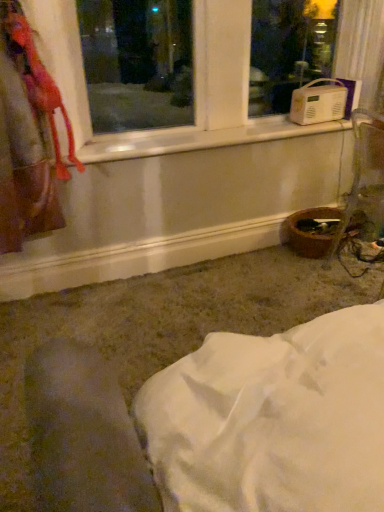
What is the approximate width of velvet-like pink scarf at upper left?

velvet-like pink scarf at upper left is 8.65 inches wide.

Where is `velvet-like pink scarf at upper left`? velvet-like pink scarf at upper left is located at coordinates coord(27,136).

Image resolution: width=384 pixels, height=512 pixels. Describe the element at coordinates (27, 136) in the screenshot. I see `velvet-like pink scarf at upper left` at that location.

This screenshot has height=512, width=384. Describe the element at coordinates (197, 61) in the screenshot. I see `white plastic radio at upper right` at that location.

The image size is (384, 512). In order to click on white plastic radio at upper right in this screenshot , I will do `click(197, 61)`.

I want to click on velvet-like pink scarf at upper left, so click(x=27, y=136).

Between velvet-like pink scarf at upper left and white plastic radio at upper right, which one appears on the left side from the viewer's perspective?

velvet-like pink scarf at upper left is more to the left.

Is velvet-like pink scarf at upper left closer to the viewer compared to white plastic radio at upper right?

Yes, the depth of velvet-like pink scarf at upper left is less than that of white plastic radio at upper right.

Does point (1, 5) come in front of point (113, 12)?

That is True.

From the picture: From the image's perspective, who appears lower, velvet-like pink scarf at upper left or white plastic radio at upper right?

velvet-like pink scarf at upper left appears lower in the image.

From a real-world perspective, is velvet-like pink scarf at upper left over white plastic radio at upper right?

No, from a real-world perspective, velvet-like pink scarf at upper left is not on top of white plastic radio at upper right.

Between velvet-like pink scarf at upper left and white plastic radio at upper right, which one has larger width?

With larger width is white plastic radio at upper right.

Which of these two, velvet-like pink scarf at upper left or white plastic radio at upper right, stands taller?

velvet-like pink scarf at upper left is taller.

Does velvet-like pink scarf at upper left have a larger size compared to white plastic radio at upper right?

No, velvet-like pink scarf at upper left is not bigger than white plastic radio at upper right.

Can we say velvet-like pink scarf at upper left lies outside white plastic radio at upper right?

Yes, velvet-like pink scarf at upper left is located beyond the bounds of white plastic radio at upper right.

Does velvet-like pink scarf at upper left touch white plastic radio at upper right?

velvet-like pink scarf at upper left is not next to white plastic radio at upper right, and they're not touching.

Could you tell me if velvet-like pink scarf at upper left is turned towards white plastic radio at upper right?

No.

Can you tell me how much velvet-like pink scarf at upper left and white plastic radio at upper right differ in facing direction?

The angular difference between velvet-like pink scarf at upper left and white plastic radio at upper right is 0.553 degrees.

How far apart are velvet-like pink scarf at upper left and white plastic radio at upper right?

They are 5.42 feet apart.

Image resolution: width=384 pixels, height=512 pixels. I want to click on laundry that is below the white plastic radio at upper right (from the image's perspective), so click(27, 136).

Which is more to the right, white plastic radio at upper right or velvet-like pink scarf at upper left?

white plastic radio at upper right.

Is white plastic radio at upper right behind velvet-like pink scarf at upper left?

Yes, the depth of white plastic radio at upper right is greater than that of velvet-like pink scarf at upper left.

Which is behind, point (212, 30) or point (22, 73)?

The point (212, 30) is behind.

From the image's perspective, between white plastic radio at upper right and velvet-like pink scarf at upper left, which one is located above?

white plastic radio at upper right appears higher in the image.

From a real-world perspective, is white plastic radio at upper right below velvet-like pink scarf at upper left?

Incorrect, from a real-world perspective, white plastic radio at upper right is higher than velvet-like pink scarf at upper left.

Can you confirm if white plastic radio at upper right is wider than velvet-like pink scarf at upper left?

Yes.

Considering the sizes of objects white plastic radio at upper right and velvet-like pink scarf at upper left in the image provided, who is taller, white plastic radio at upper right or velvet-like pink scarf at upper left?

velvet-like pink scarf at upper left is taller.

Between white plastic radio at upper right and velvet-like pink scarf at upper left, which one has larger size?

With larger size is white plastic radio at upper right.

From the picture: Is white plastic radio at upper right positioned beyond the bounds of velvet-like pink scarf at upper left?

Indeed, white plastic radio at upper right is completely outside velvet-like pink scarf at upper left.

Would you say white plastic radio at upper right is a long distance from velvet-like pink scarf at upper left?

Yes, white plastic radio at upper right and velvet-like pink scarf at upper left are located far from each other.

Is white plastic radio at upper right aimed at velvet-like pink scarf at upper left?

Yes.

How many degrees apart are the facing directions of white plastic radio at upper right and velvet-like pink scarf at upper left?

The angular difference between white plastic radio at upper right and velvet-like pink scarf at upper left is 0.553 degrees.

The image size is (384, 512). I want to click on bay window behind the velvet-like pink scarf at upper left, so pos(197,61).

Find the location of `laundry to the left of white plastic radio at upper right`. laundry to the left of white plastic radio at upper right is located at coordinates (27, 136).

In the image, there is a white plastic radio at upper right. Identify the location of laundry below it (from a real-world perspective). (27, 136).